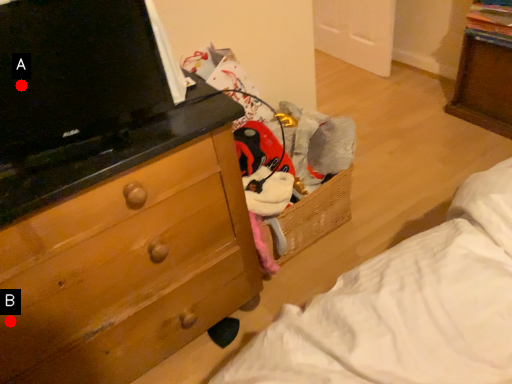
Question: Two points are circled on the image, labeled by A and B beside each circle. Which point is closer to the camera?

Choices:
 (A) A is closer
 (B) B is closer

Answer: (A)